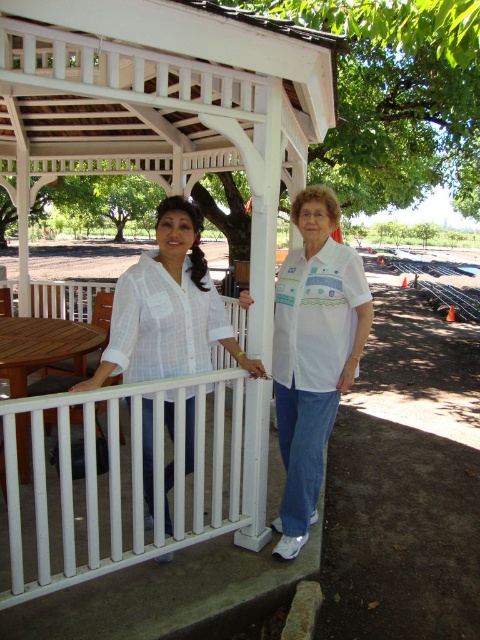
Question: Among these points, which one is farthest from the camera?

Choices:
 (A) (146, 292)
 (B) (327, 220)

Answer: (B)

Question: Can you confirm if white cotton shirt at center is positioned above white woven blouse at center?

Choices:
 (A) no
 (B) yes

Answer: (B)

Question: Which point is closer to the camera?

Choices:
 (A) white woven blouse at center
 (B) white cotton shirt at center

Answer: (A)

Question: Is white cotton shirt at center in front of white woven blouse at center?

Choices:
 (A) no
 (B) yes

Answer: (A)

Question: Is white cotton shirt at center positioned at the back of white woven blouse at center?

Choices:
 (A) yes
 (B) no

Answer: (A)